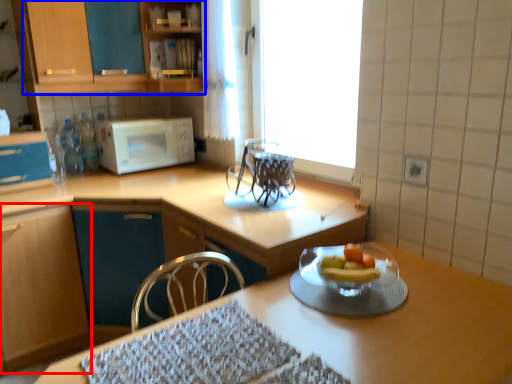
Question: Which object appears closest to the camera in this image, cabinetry (highlighted by a red box) or cabinetry (highlighted by a blue box)?

Choices:
 (A) cabinetry
 (B) cabinetry

Answer: (A)